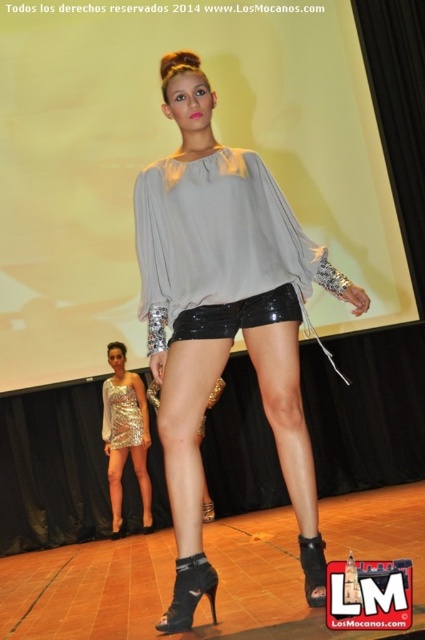
You are a photographer at the runway show. You want to capture a photo of both models. The first model is at point (144, 522) and the second model is at point (314, 552). Which model is closer to the camera?

Point (144, 522) is behind point (314, 552), so the second model at point (314, 552) is closer to the camera.

You are a photographer at the runway show. You need to capture a shot of the model wearing black shiny shorts at center. Where should you aim your camera to ensure the shorts are in focus? Please provide the coordinates in the format of a point like point (x=237, y=316).

The black shiny shorts at center are located at point (x=237, y=316), so you should aim your camera at point (x=237, y=316) to ensure the shorts are in focus.

You are a photographer at the fashion show. You need to adjust your camera to capture both the matte gray blouse at center and the silver sequined dress at center in the same frame. Which clothing item should you focus on first to ensure they are both in focus?

The matte gray blouse at center might be wider than the silver sequined dress at center, so focusing on the wider matte gray blouse at center first would help ensure both are in focus.